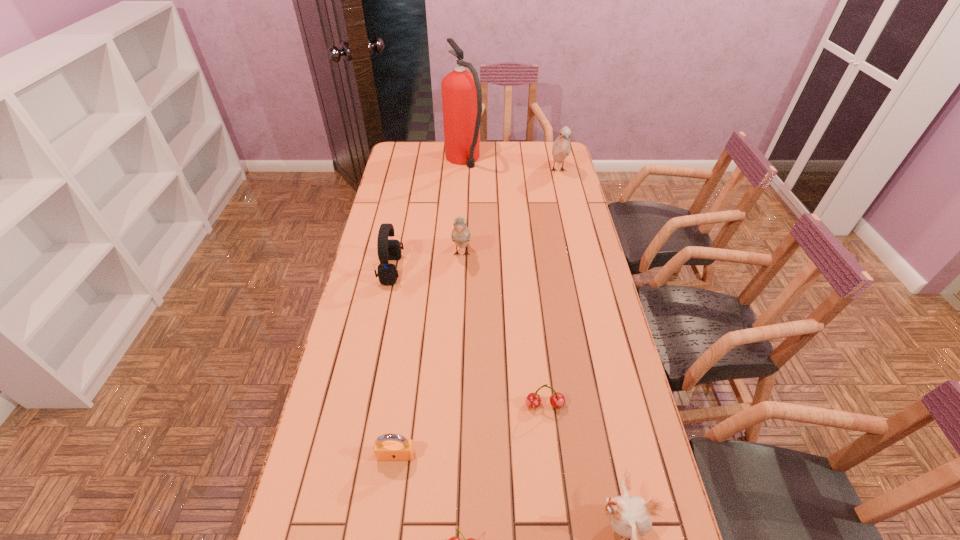
Where is `vacant region located 0.140m at the face of the second shortest bird`? This screenshot has width=960, height=540. vacant region located 0.140m at the face of the second shortest bird is located at coordinates (460, 299).

This screenshot has width=960, height=540. What are the coordinates of `vacant region located on the headband of the headset` in the screenshot? It's located at (490, 269).

Image resolution: width=960 pixels, height=540 pixels. Identify the location of vacant space situated 0.080m to unlock the padlock from the front. (391, 496).

At what (x,y) coordinates should I click in order to perform the action: click on free space located with stems pointing upwards on the fourth nearest object. Please return your answer as a coordinate pair (x, y). The height and width of the screenshot is (540, 960). Looking at the image, I should click on (547, 431).

Locate an element on the screen. This screenshot has height=540, width=960. fire extinguisher located in the far edge section of the desktop is located at coordinates (461, 91).

This screenshot has height=540, width=960. Find the location of `bird that is at the far edge`. bird that is at the far edge is located at coordinates (561, 148).

Where is `object at the left edge`? The height and width of the screenshot is (540, 960). object at the left edge is located at coordinates [x=388, y=249].

Where is `object that is positioned at the right edge`? object that is positioned at the right edge is located at coordinates (561, 148).

At what (x,y) coordinates should I click in order to perform the action: click on object positioned at the far right corner. Please return your answer as a coordinate pair (x, y). Image resolution: width=960 pixels, height=540 pixels. Looking at the image, I should click on (561, 148).

This screenshot has width=960, height=540. In the image, there is a desktop. What are the coordinates of `free space at the far edge` in the screenshot? It's located at (528, 164).